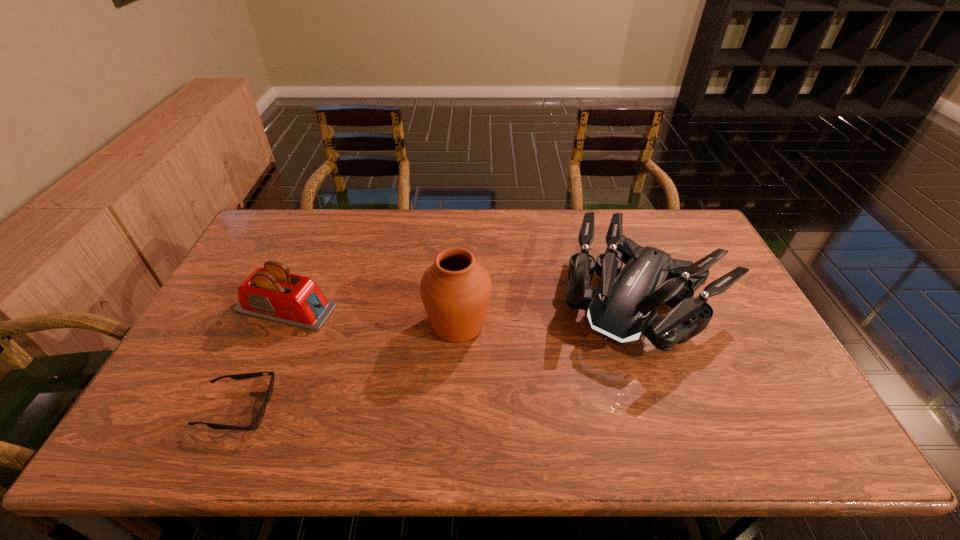
Point out which object is positioned as the third nearest to the shortest object. Please provide its 2D coordinates. Your answer should be formatted as a tuple, i.e. [(x, y)], where the tuple contains the x and y coordinates of a point satisfying the conditions above.

[(625, 307)]

You are a GUI agent. You are given a task and a screenshot of the screen. Output one action in this format:
    pyautogui.click(x=<x>, y=<y>)
    Task: Click on the vacant space that satisfies the following two spatial constraints: 1. on the front side of the rightmost object; 2. on the front-facing side of the nearest object
    
    Given the screenshot: What is the action you would take?
    pos(683,408)

I want to click on vacant area that satisfies the following two spatial constraints: 1. on the front side of the urn; 2. on the front-facing side of the sunglasses, so click(x=454, y=408).

Identify the location of vacant area in the image that satisfies the following two spatial constraints: 1. on the back side of the second object from right to left; 2. on the right side of the rightmost object. (459, 301).